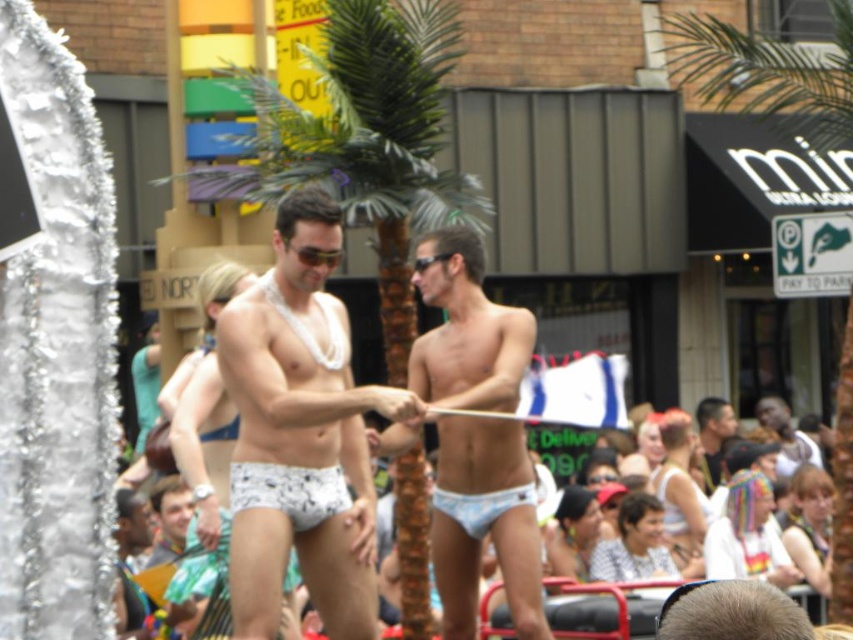
Which is more to the right, white printed underwear at center or green leafy palm tree at center?

From the viewer's perspective, green leafy palm tree at center appears more on the right side.

Describe the element at coordinates (300, 433) in the screenshot. I see `white printed underwear at center` at that location.

Identify the location of white printed underwear at center. This screenshot has height=640, width=853. (300, 433).

Does white glossy underwear at center have a lesser width compared to smooth skin head at center?

Indeed, white glossy underwear at center has a lesser width compared to smooth skin head at center.

Is point (403, 424) positioned in front of point (718, 419)?

Yes, point (403, 424) is in front of point (718, 419).

The image size is (853, 640). What do you see at coordinates (485, 522) in the screenshot? I see `white glossy underwear at center` at bounding box center [485, 522].

You are a GUI agent. You are given a task and a screenshot of the screen. Output one action in this format:
    pyautogui.click(x=<x>, y=<y>)
    Task: Click on the white glossy underwear at center
    The width and height of the screenshot is (853, 640).
    Given the screenshot: What is the action you would take?
    pyautogui.click(x=485, y=522)

Between white glossy underwear at center and white printed fabric underwear at center, which one is positioned lower?

white glossy underwear at center

Between white glossy underwear at center and white printed fabric underwear at center, which one has more height?

With more height is white printed fabric underwear at center.

Which is behind, point (523, 593) or point (299, 518)?

The point (523, 593) is more distant.

You are a GUI agent. You are given a task and a screenshot of the screen. Output one action in this format:
    pyautogui.click(x=<x>, y=<y>)
    Task: Click on the white glossy underwear at center
    The image size is (853, 640).
    Given the screenshot: What is the action you would take?
    pyautogui.click(x=485, y=522)